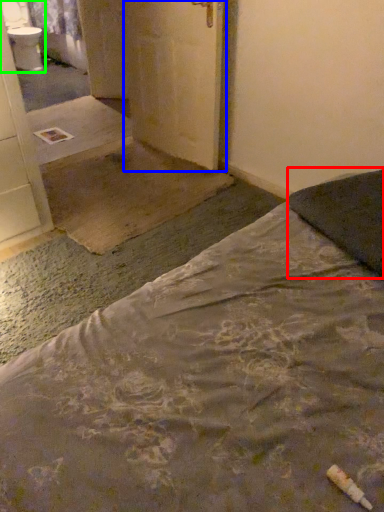
Question: Which object is the closest to the pillow (highlighted by a red box)? Choose among these: door (highlighted by a blue box) or sink (highlighted by a green box).

Choices:
 (A) door
 (B) sink

Answer: (A)